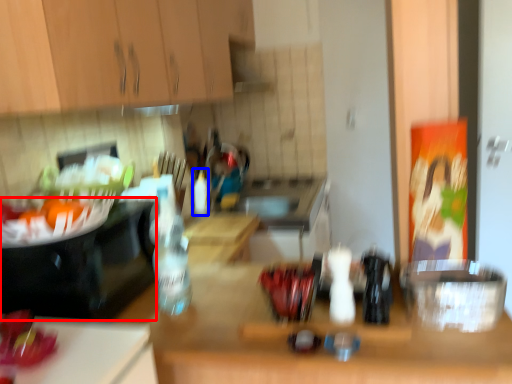
Question: Which of the following is the closest to the observer, appliance (highlighted by a red box) or bottle (highlighted by a blue box)?

Choices:
 (A) appliance
 (B) bottle

Answer: (A)